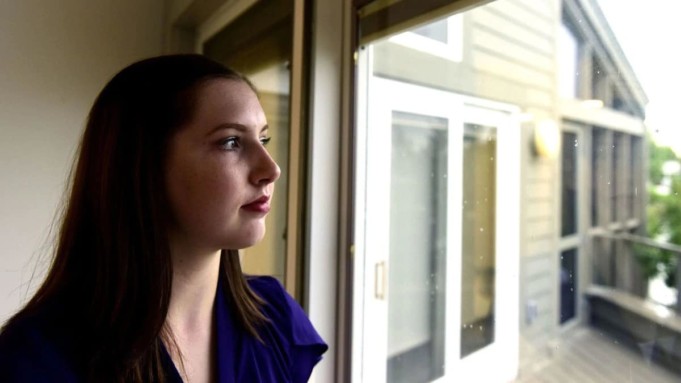
Where is `glasss door`? The image size is (681, 383). glasss door is located at coordinates (475, 291), (422, 271).